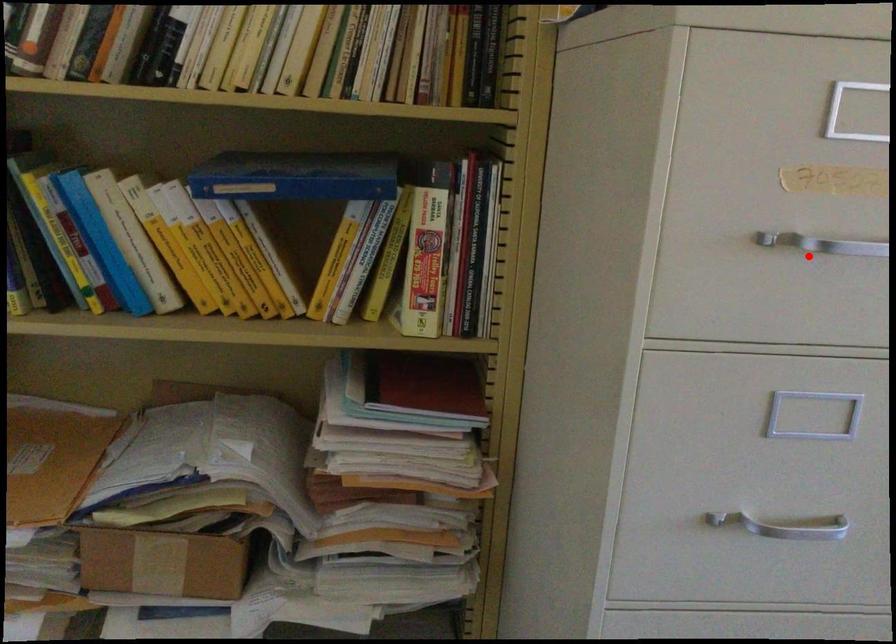
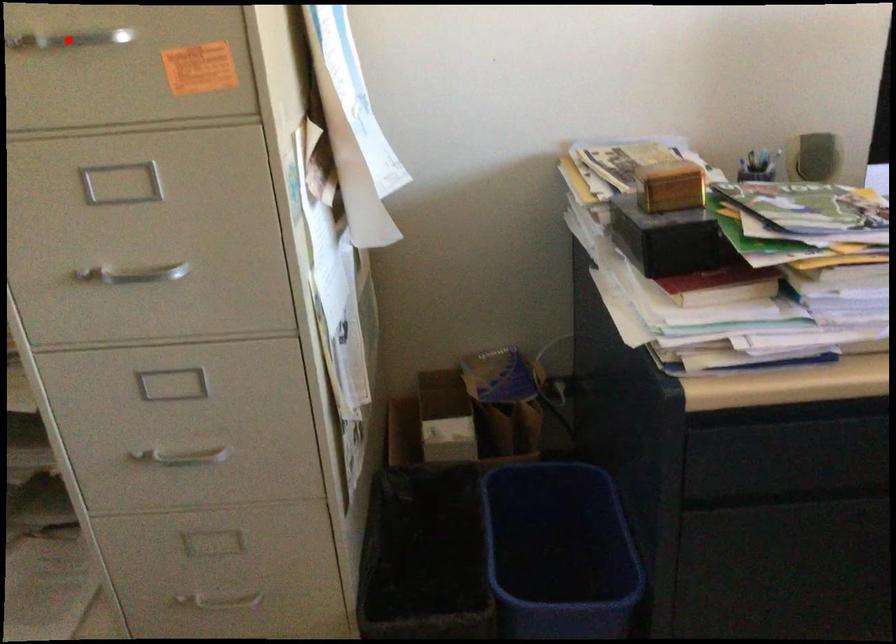
Based on the photo, I am providing you with two images of the same scene from different viewpoints. A red point is marked on the first image and another point is marked on the second image. Is the marked point in image1 the same physical position as the marked point in image2?

Yes